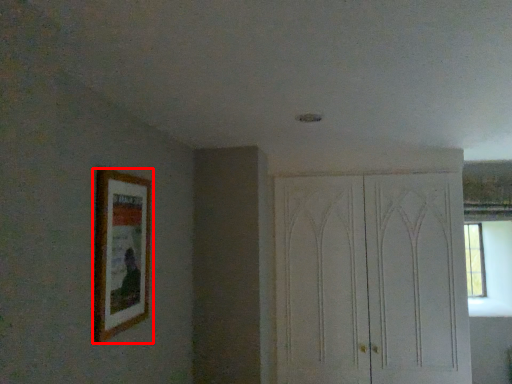
Question: From the image's perspective, what is the correct spatial relationship of picture frame (annotated by the red box) in relation to dresser?

Choices:
 (A) above
 (B) below

Answer: (A)